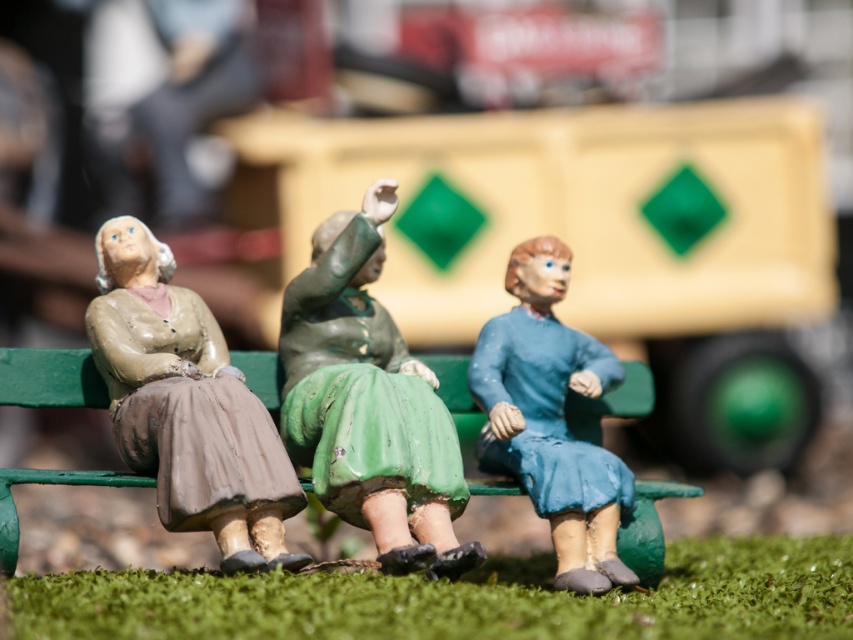
Does matte clay figure at left have a lesser width compared to green painted wood park bench at center?

Yes, matte clay figure at left is thinner than green painted wood park bench at center.

Between matte clay figure at left and green painted wood park bench at center, which one is positioned higher?

Positioned higher is matte clay figure at left.

Is point (177, 467) in front of point (500, 486)?

Yes, point (177, 467) is closer to viewer.

At what (x,y) coordinates should I click in order to perform the action: click on matte clay figure at left. Please return your answer as a coordinate pair (x, y). The width and height of the screenshot is (853, 640). Looking at the image, I should click on (187, 404).

Is green matte figure at center below matte clay figure at left?

No, green matte figure at center is not below matte clay figure at left.

Is point (428, 404) behind point (242, 564)?

Yes, point (428, 404) is behind point (242, 564).

This screenshot has height=640, width=853. What do you see at coordinates (369, 403) in the screenshot?
I see `green matte figure at center` at bounding box center [369, 403].

At what (x,y) coordinates should I click in order to perform the action: click on green matte figure at center. Please return your answer as a coordinate pair (x, y). The height and width of the screenshot is (640, 853). Looking at the image, I should click on (369, 403).

Find the location of a particular element. The image size is (853, 640). blue matte figure at center is located at coordinates (550, 419).

Where is `blue matte figure at center`? Image resolution: width=853 pixels, height=640 pixels. blue matte figure at center is located at coordinates (550, 419).

Locate an element on the screen. blue matte figure at center is located at coordinates (550, 419).